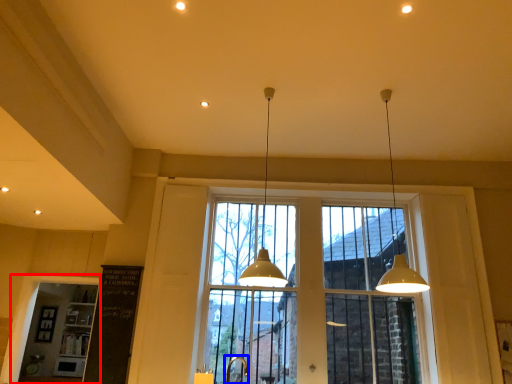
Question: Which point is closer to the camera, window frame (highlighted by a red box) or faucet (highlighted by a blue box)?

Choices:
 (A) window frame
 (B) faucet

Answer: (B)